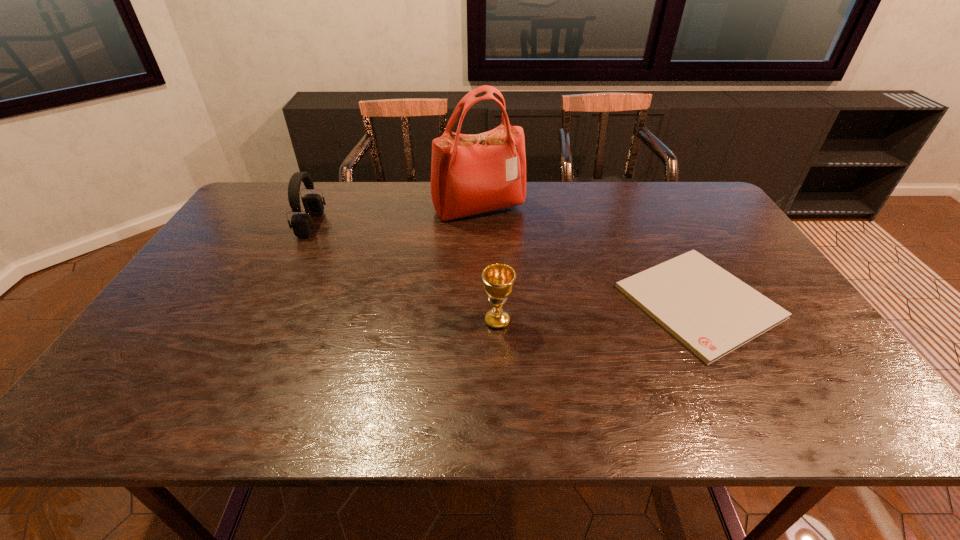
The height and width of the screenshot is (540, 960). I want to click on vacant space that satisfies the following two spatial constraints: 1. on the front-facing side of the tallest object; 2. on the right side of the shortest object, so click(478, 302).

The width and height of the screenshot is (960, 540). I want to click on vacant space that satisfies the following two spatial constraints: 1. on the front-facing side of the handbag; 2. on the left side of the chalice, so click(478, 321).

Locate an element on the screen. The image size is (960, 540). vacant area that satisfies the following two spatial constraints: 1. on the front-facing side of the chalice; 2. on the right side of the handbag is located at coordinates (478, 321).

Locate an element on the screen. vacant space that satisfies the following two spatial constraints: 1. on the headband of the headset; 2. on the left side of the shortest object is located at coordinates (272, 302).

Find the location of a particular element. The height and width of the screenshot is (540, 960). vacant area that satisfies the following two spatial constraints: 1. on the front-facing side of the handbag; 2. on the right side of the chalice is located at coordinates (478, 321).

In order to click on free space that satisfies the following two spatial constraints: 1. on the headband of the headset; 2. on the right side of the chalice in this screenshot , I will do coord(262,321).

The height and width of the screenshot is (540, 960). I want to click on vacant area in the image that satisfies the following two spatial constraints: 1. on the front-facing side of the tallest object; 2. on the headband of the headset, so click(479, 225).